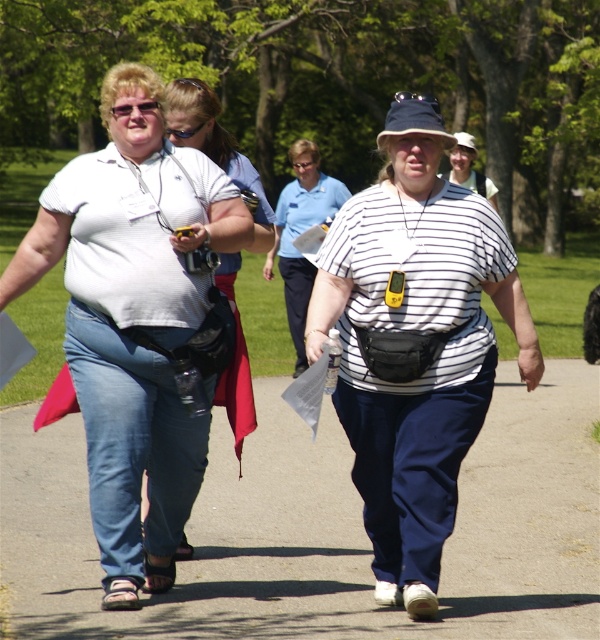
Can you confirm if navy blue fabric baseball hat at center is taller than clear plastic goggles at upper center?

Correct, navy blue fabric baseball hat at center is much taller as clear plastic goggles at upper center.

Is navy blue fabric baseball hat at center behind clear plastic goggles at upper center?

That is False.

The width and height of the screenshot is (600, 640). I want to click on navy blue fabric baseball hat at center, so click(x=413, y=118).

Consider the image. Is white matte shirt at upper left shorter than navy blue fabric baseball hat at center?

Yes, white matte shirt at upper left is shorter than navy blue fabric baseball hat at center.

The width and height of the screenshot is (600, 640). What are the coordinates of `white matte shirt at upper left` in the screenshot? It's located at (136, 321).

The width and height of the screenshot is (600, 640). Identify the location of white matte shirt at upper left. (136, 321).

Does white matte shirt at upper left appear under clear plastic goggles at upper center?

Yes.

Which is in front, point (124, 316) or point (193, 131)?

Point (124, 316)

Find the location of a particular element. white matte shirt at upper left is located at coordinates (136, 321).